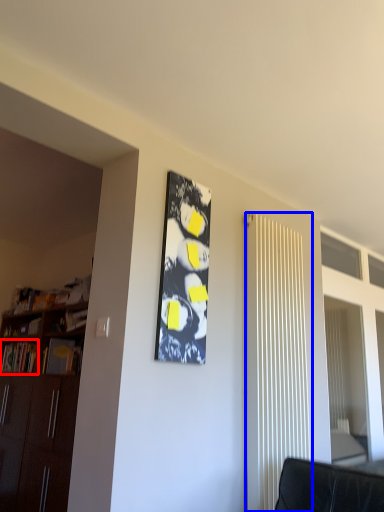
Question: Which object is closer to the camera taking this photo, book (highlighted by a red box) or radiator (highlighted by a blue box)?

Choices:
 (A) book
 (B) radiator

Answer: (B)